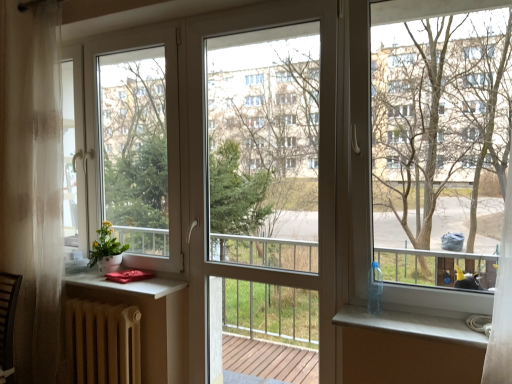
Question: From a real-world perspective, is matte brown radiator at lower left above or below transparent glass screen door at center?

Choices:
 (A) above
 (B) below

Answer: (B)

Question: In the image, is matte brown radiator at lower left positioned in front of or behind transparent glass screen door at center?

Choices:
 (A) behind
 (B) front

Answer: (A)

Question: Which object is the closest to the matte white pot at left?

Choices:
 (A) bare wood tree at right
 (B) white glossy window sill at lower right
 (C) transparent glass screen door at center
 (D) matte brown radiator at lower left

Answer: (D)

Question: Estimate the real-world distances between objects in this image. Which object is farther from the bare wood tree at right?

Choices:
 (A) transparent glass screen door at center
 (B) white glossy window sill at lower right
 (C) matte white pot at left
 (D) matte brown radiator at lower left

Answer: (C)